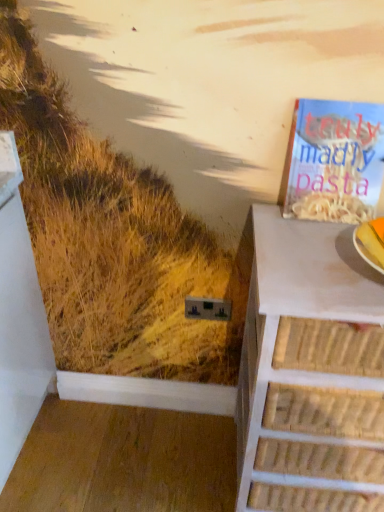
Question: In the image, is white wicker chest of drawers at right positioned in front of or behind matte paper book at upper right?

Choices:
 (A) front
 (B) behind

Answer: (A)

Question: In terms of height, does white wicker chest of drawers at right look taller or shorter compared to matte paper book at upper right?

Choices:
 (A) short
 (B) tall

Answer: (B)

Question: From a real-world perspective, relative to matte paper book at upper right, is white wicker chest of drawers at right vertically above or below?

Choices:
 (A) below
 (B) above

Answer: (A)

Question: In the image, is matte paper book at upper right on the left side or the right side of white wicker chest of drawers at right?

Choices:
 (A) right
 (B) left

Answer: (B)

Question: From a real-world perspective, is matte paper book at upper right physically located above or below white wicker chest of drawers at right?

Choices:
 (A) above
 (B) below

Answer: (A)

Question: In terms of width, does matte paper book at upper right look wider or thinner when compared to white wicker chest of drawers at right?

Choices:
 (A) thin
 (B) wide

Answer: (A)

Question: Is matte paper book at upper right taller or shorter than white wicker chest of drawers at right?

Choices:
 (A) short
 (B) tall

Answer: (A)